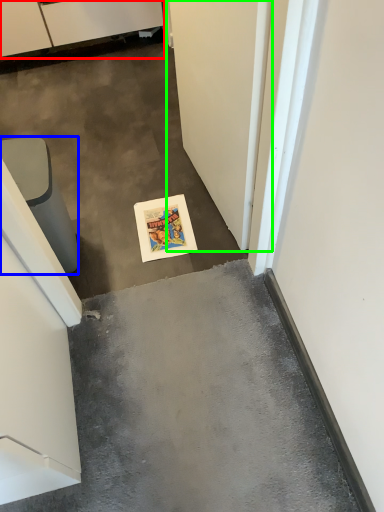
Question: Which object is positioned farthest from cabinetry (highlighted by a red box)? Select from furniture (highlighted by a blue box) and door (highlighted by a green box).

Choices:
 (A) furniture
 (B) door

Answer: (B)